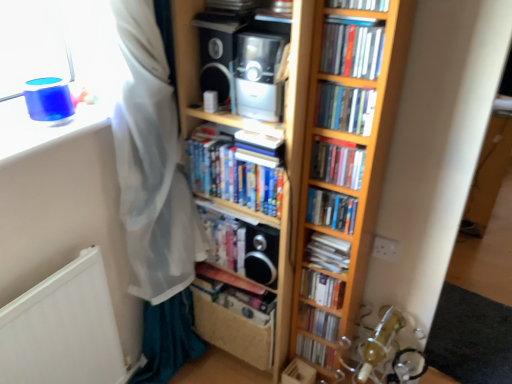
Question: In the image, is white paper book at center, which is counted as the 5th book, starting from the bottom, positioned in front of or behind hardcover book at center, which is the 11th book in top-to-bottom order?

Choices:
 (A) front
 (B) behind

Answer: (A)

Question: From the image's perspective, is white paper book at center, which is counted as the 5th book, starting from the bottom, positioned above or below hardcover book at center, which is the 11th book in top-to-bottom order?

Choices:
 (A) below
 (B) above

Answer: (B)

Question: Which object is the farthest from the hardcover book at center, acting as the 3th book starting from the top?

Choices:
 (A) matte plastic books at upper right, positioned as the eleventh book in bottom-to-top order
 (B) hardcover book at center, marked as the 7th book in a top-to-bottom arrangement
 (C) hardcover book at center, arranged as the 10th book when viewed from the top
 (D) hardcover books at center, arranged as the 5th book when viewed from the top
 (E) hardcover book at center, placed as the twelfth book when sorted from top to bottom

Answer: (E)

Question: Considering the real-world distances, which object is farthest from the wooden bookcase at center?

Choices:
 (A) white matte radiator at lower left
 (B) hardcover book at center, which appears as the 3th book when ordered from the bottom
 (C) satin black speaker at center, which appears as the 1th speaker when ordered from the bottom
 (D) hardcover book at upper center, marked as the 12th book in a bottom-to-top arrangement
 (E) matte plastic books at upper right, positioned as the eleventh book in bottom-to-top order

Answer: (A)